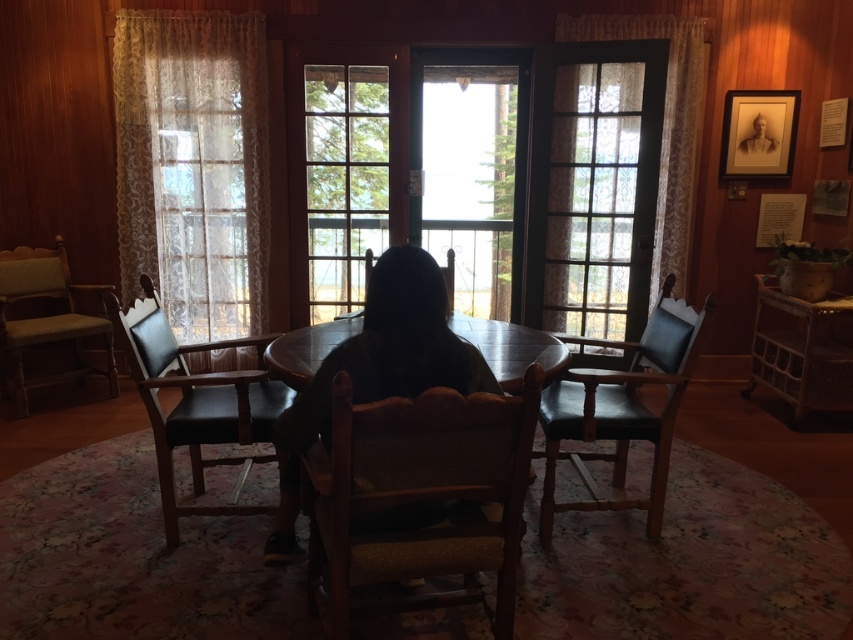
Question: Which point is farther from the camera taking this photo?

Choices:
 (A) (664, 282)
 (B) (440, 438)
 (C) (387, 284)
 (D) (61, 326)

Answer: (D)

Question: Is dark brown leather chair at center further to camera compared to matte black chair at center?

Choices:
 (A) yes
 (B) no

Answer: (B)

Question: Does wooden upholstered chair at center appear on the left side of wooden chair at center?

Choices:
 (A) yes
 (B) no

Answer: (A)

Question: Which point is farther to the camera?

Choices:
 (A) (22, 396)
 (B) (334, 317)

Answer: (B)

Question: Is wooden upholstered chair at center bigger than black leather chair at left?

Choices:
 (A) yes
 (B) no

Answer: (B)

Question: Among these points, which one is farthest from the camera?

Choices:
 (A) (355, 492)
 (B) (370, 273)
 (C) (264, 355)

Answer: (C)